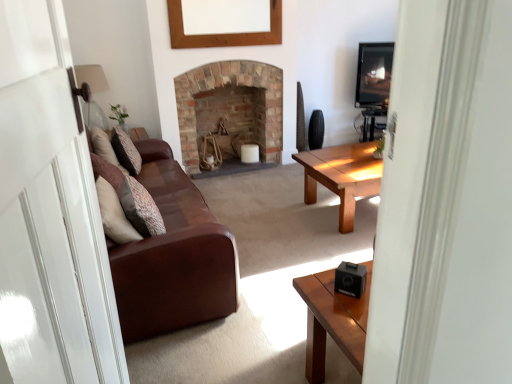
The width and height of the screenshot is (512, 384). In order to click on vacant space to the left of black plastic speaker at lower right in this screenshot , I will do `click(320, 295)`.